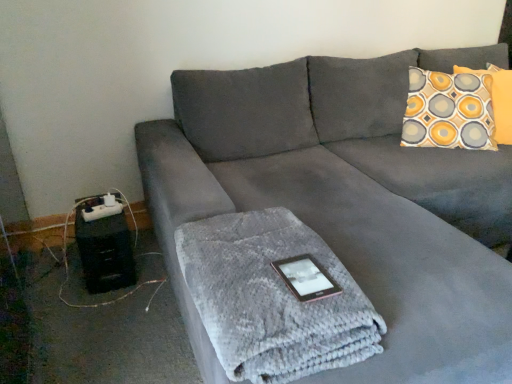
Question: Is pink glossy tablet at center closer to camera compared to yellow and gray patterned pillow at upper right?

Choices:
 (A) yes
 (B) no

Answer: (A)

Question: From the image's perspective, is pink glossy tablet at center on top of yellow and gray patterned pillow at upper right?

Choices:
 (A) yes
 (B) no

Answer: (B)

Question: Is pink glossy tablet at center positioned far away from yellow and gray patterned pillow at upper right?

Choices:
 (A) yes
 (B) no

Answer: (A)

Question: Considering the relative sizes of pink glossy tablet at center and yellow and gray patterned pillow at upper right in the image provided, is pink glossy tablet at center thinner than yellow and gray patterned pillow at upper right?

Choices:
 (A) no
 (B) yes

Answer: (B)

Question: Is pink glossy tablet at center oriented away from yellow and gray patterned pillow at upper right?

Choices:
 (A) yes
 (B) no

Answer: (B)

Question: Can we say pink glossy tablet at center lies outside yellow and gray patterned pillow at upper right?

Choices:
 (A) no
 (B) yes

Answer: (B)

Question: Is patterned fabric pillow at upper right oriented away from pink glossy tablet at center?

Choices:
 (A) yes
 (B) no

Answer: (B)

Question: Is patterned fabric pillow at upper right smaller than pink glossy tablet at center?

Choices:
 (A) yes
 (B) no

Answer: (B)

Question: Does patterned fabric pillow at upper right have a lesser width compared to pink glossy tablet at center?

Choices:
 (A) yes
 (B) no

Answer: (B)

Question: Is patterned fabric pillow at upper right located outside pink glossy tablet at center?

Choices:
 (A) no
 (B) yes

Answer: (B)

Question: Does patterned fabric pillow at upper right have a larger size compared to pink glossy tablet at center?

Choices:
 (A) no
 (B) yes

Answer: (B)

Question: Does patterned fabric pillow at upper right lie behind pink glossy tablet at center?

Choices:
 (A) no
 (B) yes

Answer: (B)

Question: From the image's perspective, is pink glossy tablet at center over suede gray couch at center?

Choices:
 (A) no
 (B) yes

Answer: (A)